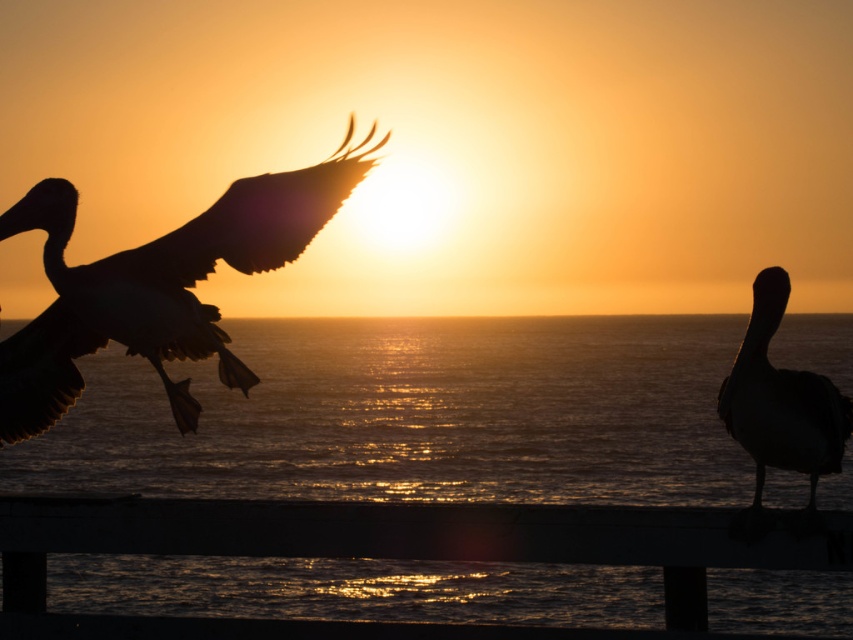
You are standing at the edge of the wooden railing in the sunset scene. If you look down, where would you see the smooth wood rail at lower center relative to your feet?

The smooth wood rail at lower center is located at point 0.866 on the x coordinate and 0.457 on the y coordinate, so it is positioned slightly to the right and above your feet.

You are a photographer trying to capture the sunset scene. You notice the smooth wood rail at lower center and the silhouette feathered bird at left. Which object in the scene appears smaller in your photo?

The smooth wood rail at lower center appears smaller in the photo compared to the silhouette feathered bird at left because the rail has a smaller size according to the description.